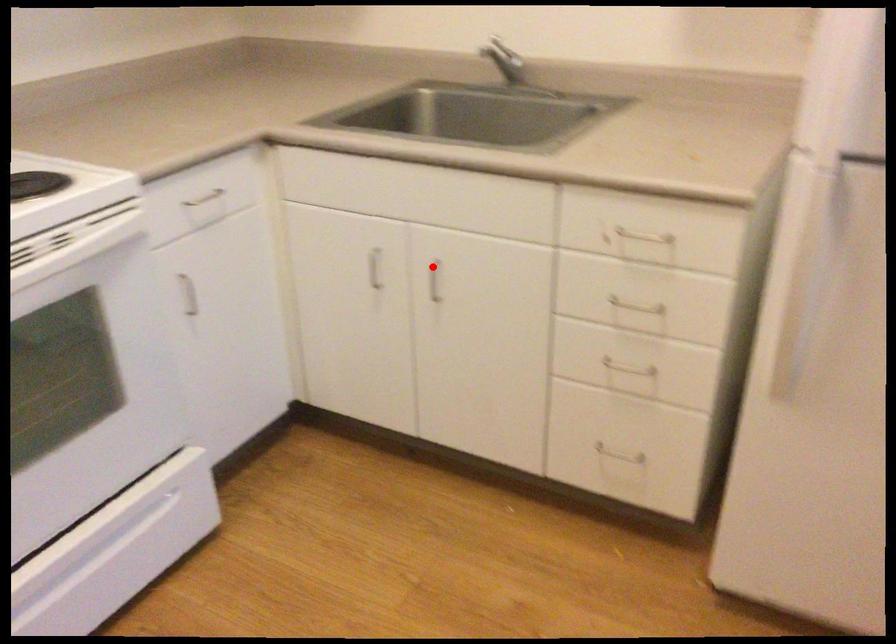
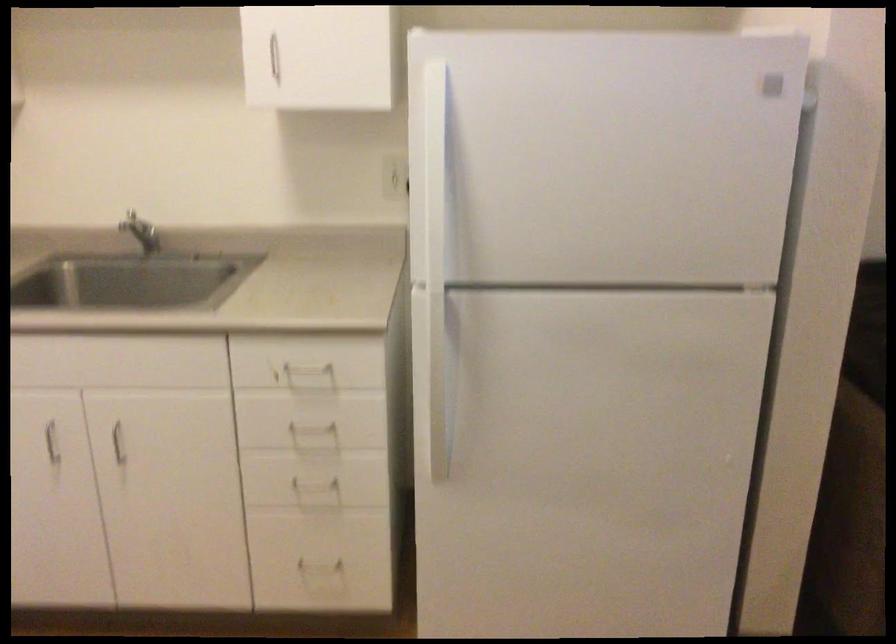
Where in the second image is the point corresponding to the highlighted location from the first image?

(116, 430)